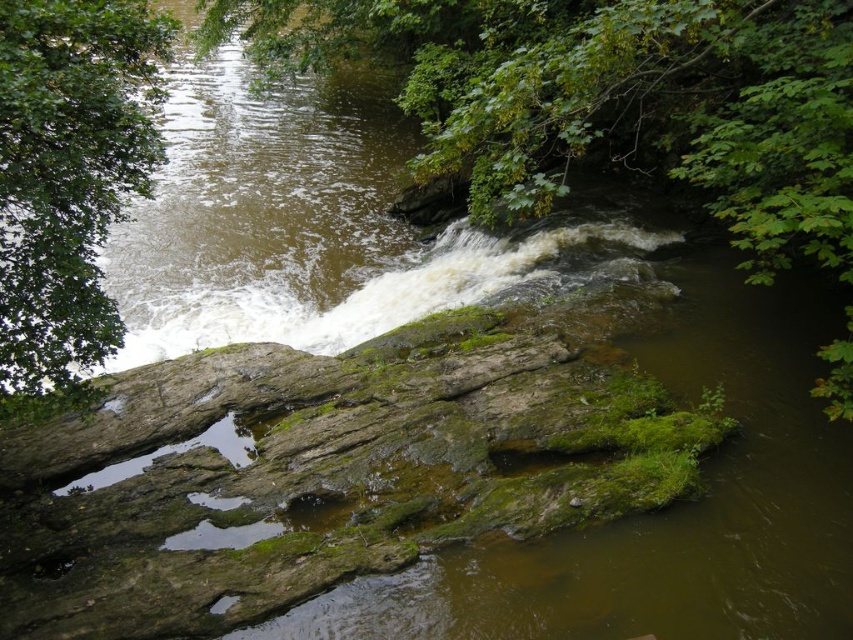
You are a hiker trying to determine which tree to use as a landmark. The scene has a green leafy tree at upper center and a green leafy tree at upper left. Which of these two trees is bigger?

The green leafy tree at upper center is larger in size compared to the green leafy tree at upper left.